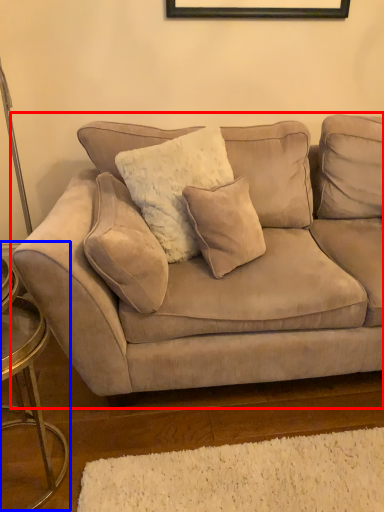
Question: Which object is further to the camera taking this photo, studio couch (highlighted by a red box) or side table (highlighted by a blue box)?

Choices:
 (A) studio couch
 (B) side table

Answer: (A)